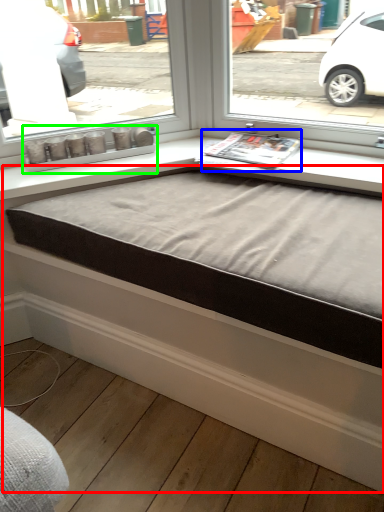
Question: Estimate the real-world distances between objects in this image. Which object is closer to bed frame (highlighted by a red box), magazine (highlighted by a blue box) or window box (highlighted by a green box)?

Choices:
 (A) magazine
 (B) window box

Answer: (A)